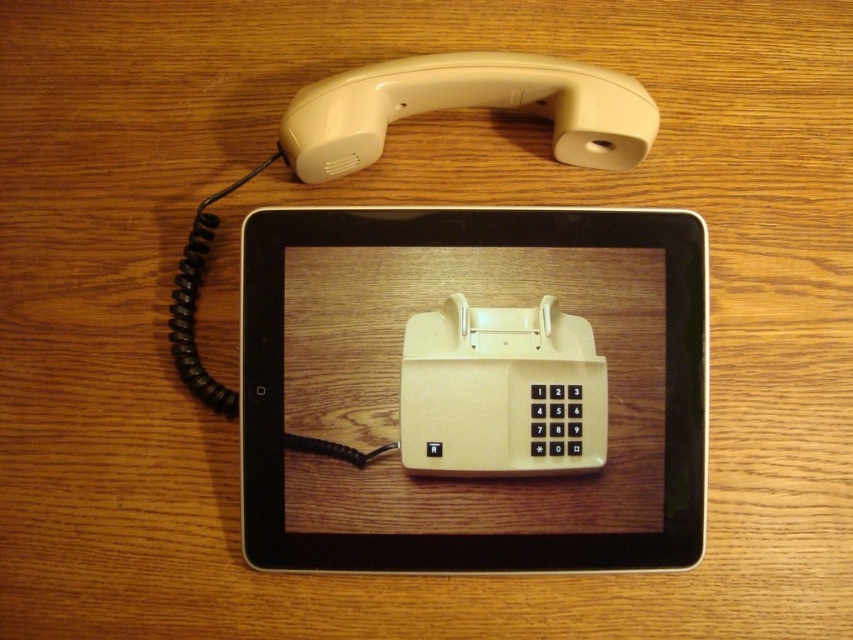
You are looking at the vintage telephone and notice a point marked at coordinates (x=474, y=388). What object is located at that point?

The point at coordinates (x=474, y=388) marks the beige plastic tablet at center.

You are holding a measuring tape and need to reach a point that is 25.59 inches away from the camera. Can you determine if the point marked at coordinates point [500,440] is exactly at that distance?

Yes, the point marked at coordinates point [500,440] is exactly 25.59 inches away from the camera.

You are arranging items on a desk and need to place the beige plastic tablet at center and the beige plastic phone at center so that they are aligned properly. According to the image, which item should be placed to the right side to ensure correct alignment?

The beige plastic phone at center should be placed to the right side because the beige plastic tablet at center is to the left of it in the image.